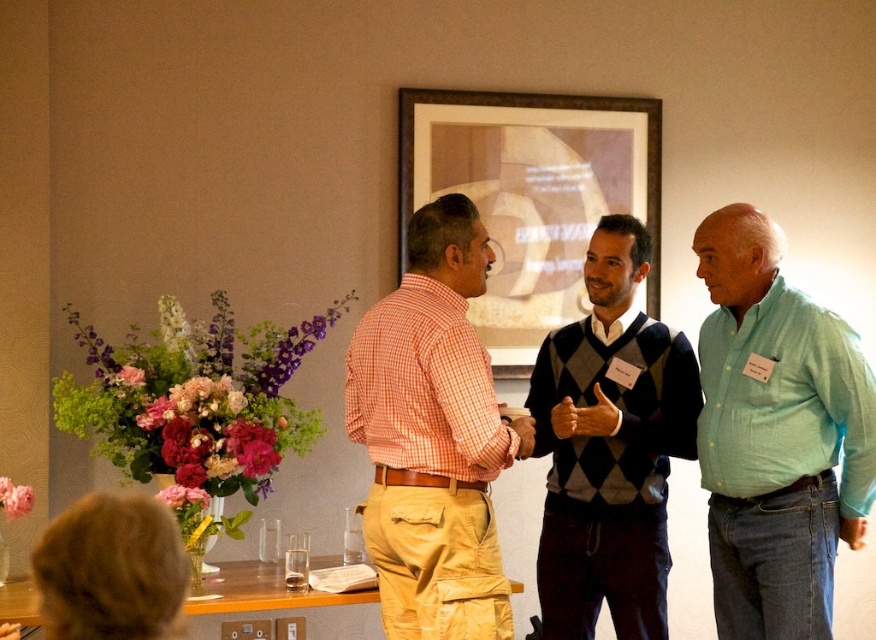
Question: Which object is farther from the camera taking this photo?

Choices:
 (A) light blue cotton shirt at right
 (B) wooden table at lower center
 (C) orange checkered shirt at center

Answer: (B)

Question: Does orange checkered shirt at center have a smaller size compared to wooden framed picture at center?

Choices:
 (A) yes
 (B) no

Answer: (A)

Question: Which object is closer to the camera taking this photo?

Choices:
 (A) wooden table at lower center
 (B) argyle sweater at center

Answer: (A)

Question: Does argyle sweater at center have a smaller size compared to wooden framed picture at center?

Choices:
 (A) no
 (B) yes

Answer: (B)

Question: Considering the real-world distances, which object is closest to the wooden framed picture at center?

Choices:
 (A) light blue cotton shirt at right
 (B) wooden table at lower center
 (C) orange checkered shirt at center

Answer: (A)

Question: Can you confirm if wooden framed picture at center is positioned below wooden table at lower center?

Choices:
 (A) no
 (B) yes

Answer: (A)